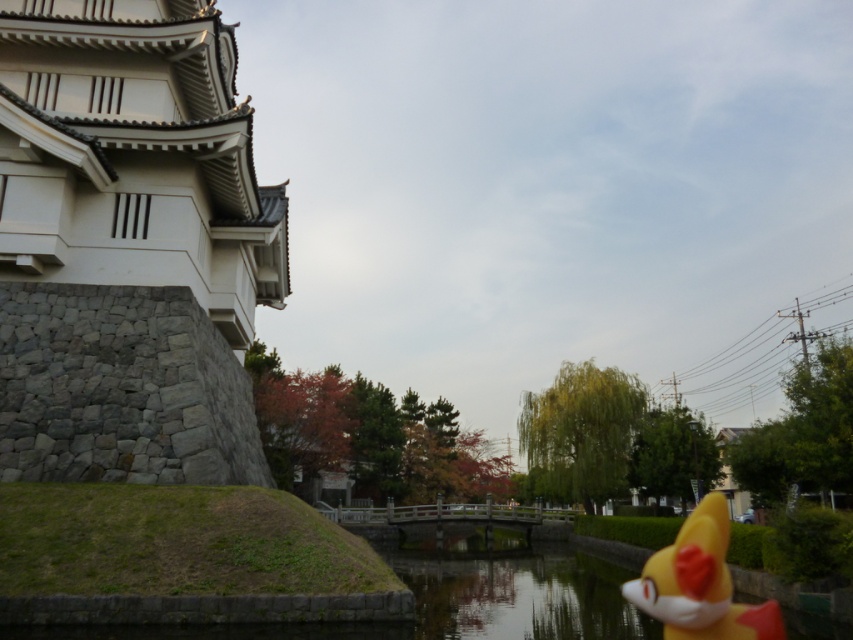
Who is more distant from viewer, (24, 333) or (665, 637)?

Positioned behind is point (24, 333).

Can you confirm if white stone tower at left is bigger than yellow rubber fox at lower right?

Actually, white stone tower at left might be smaller than yellow rubber fox at lower right.

Describe the element at coordinates (129, 244) in the screenshot. I see `white stone tower at left` at that location.

Identify the location of white stone tower at left. This screenshot has height=640, width=853. (129, 244).